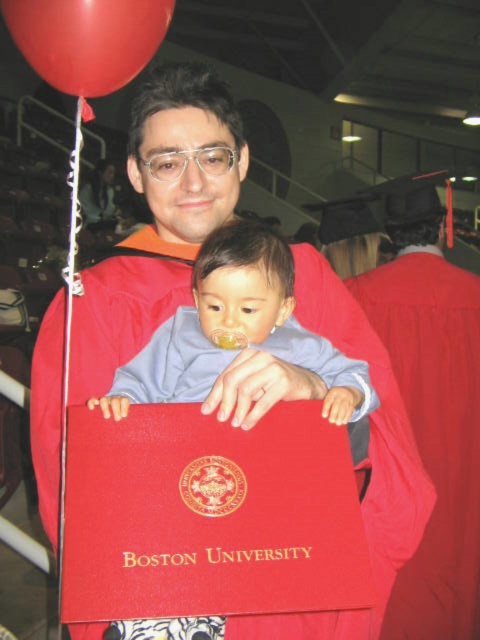
You are attending a graduation ceremony and notice the red matte graduation gown at center and the rubber balloon at upper left. From your perspective, which object is closer to you?

The red matte graduation gown at center is closer to you because the rubber balloon at upper left is behind it.

You are organizing a photo shoot and need to ensure that the red matte graduation gown at center and the smooth blue shirt at center fit within a 3 meter wide backdrop. Given their widths, will both items fit side by side?

The red matte graduation gown at center is narrower than the smooth blue shirt at center. However, since the total width of both items combined may still exceed 3 meters, it depends on their exact measurements. Without specific dimensions, we cannot confirm if they will fit side by side within the 3 meter backdrop.